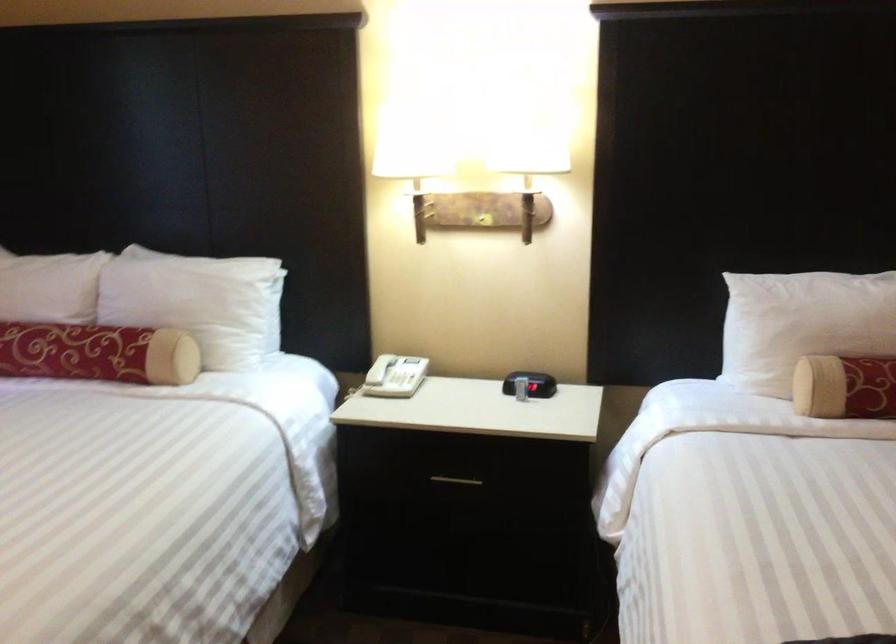
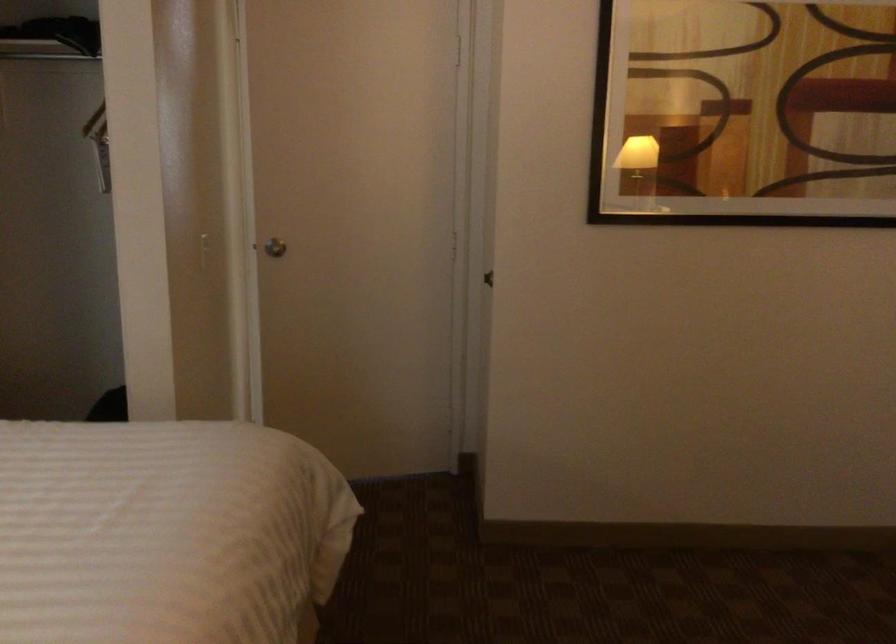
Question: How did the camera likely rotate?

Choices:
 (A) Left
 (B) Right
 (C) Up
 (D) Down

Answer: (B)